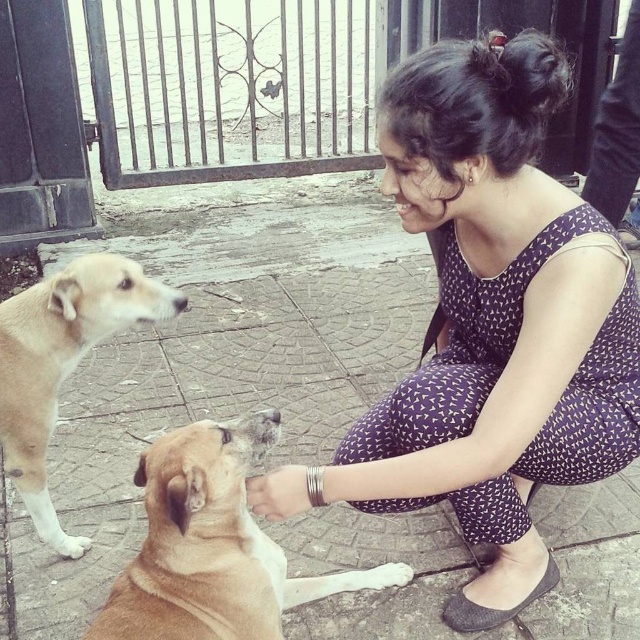
Question: Is light brown fur dog at lower left positioned before white fur paw at lower left?

Choices:
 (A) no
 (B) yes

Answer: (B)

Question: Which point appears farthest from the camera in this image?

Choices:
 (A) (88, 540)
 (B) (288, 580)

Answer: (A)

Question: Among these points, which one is farthest from the camera?

Choices:
 (A) (88, 538)
 (B) (365, 448)
 (C) (330, 588)

Answer: (A)

Question: Can you confirm if brown furry dog at lower left is positioned below white fur paw at lower left?

Choices:
 (A) yes
 (B) no

Answer: (B)

Question: Does purple printed dress at center have a greater width compared to brown furry dog at lower left?

Choices:
 (A) yes
 (B) no

Answer: (A)

Question: Based on their relative distances, which object is farther from the brown fur paw at center?

Choices:
 (A) brown furry dog at lower left
 (B) white fur paw at lower center
 (C) purple printed dress at center
 (D) white fur paw at lower left

Answer: (D)